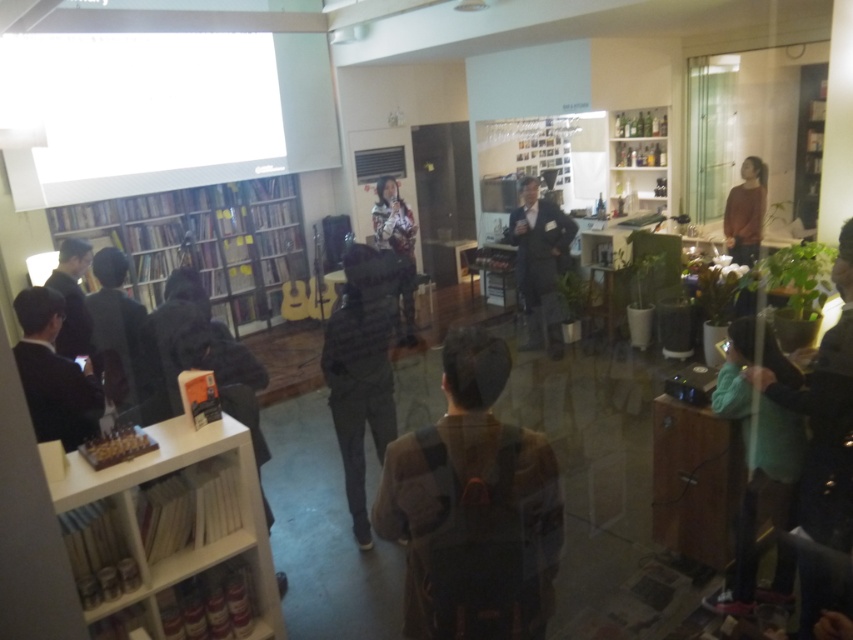
Question: Can you confirm if brown fabric backpack at center is wider than white wooden bookshelf at lower left?

Choices:
 (A) no
 (B) yes

Answer: (A)

Question: Can you confirm if dark gray suit at center is positioned to the left of clear glass shelves at upper right?

Choices:
 (A) no
 (B) yes

Answer: (B)

Question: Which of these objects is positioned closest to the clear glass shelves at upper right?

Choices:
 (A) brown fabric backpack at center
 (B) silky black dress at center
 (C) wooden bookcase at left
 (D) green fabric jacket at lower right

Answer: (B)

Question: Which of the following is the closest to the observer?

Choices:
 (A) (109, 371)
 (B) (68, 353)
 (C) (390, 412)

Answer: (A)

Question: Which point appears farthest from the camera in this image?

Choices:
 (A) (407, 336)
 (B) (747, 563)
 (C) (236, 298)
 (D) (70, 289)

Answer: (C)

Question: Can you confirm if wooden bookcase at left is bigger than silky black dress at center?

Choices:
 (A) yes
 (B) no

Answer: (A)